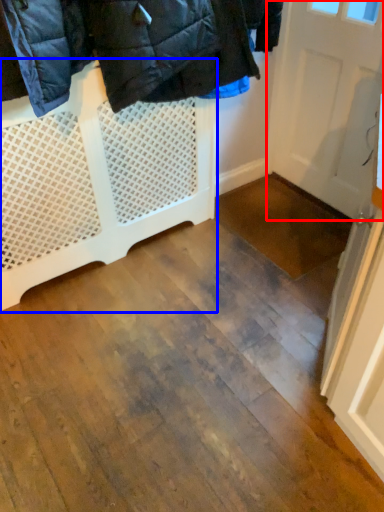
Question: Which of the following is the closest to the observer, door (highlighted by a red box) or furniture (highlighted by a blue box)?

Choices:
 (A) door
 (B) furniture

Answer: (B)